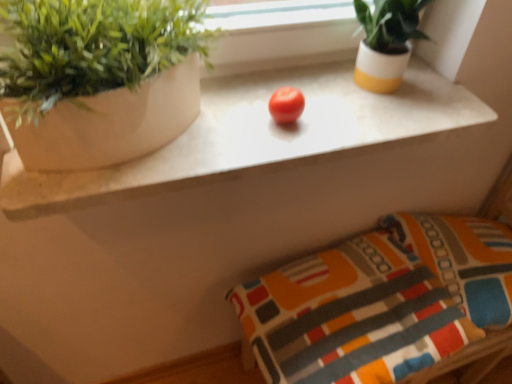
Where is `free space that is to the left of white glossy pot at upper right`? The image size is (512, 384). free space that is to the left of white glossy pot at upper right is located at coordinates point(302,84).